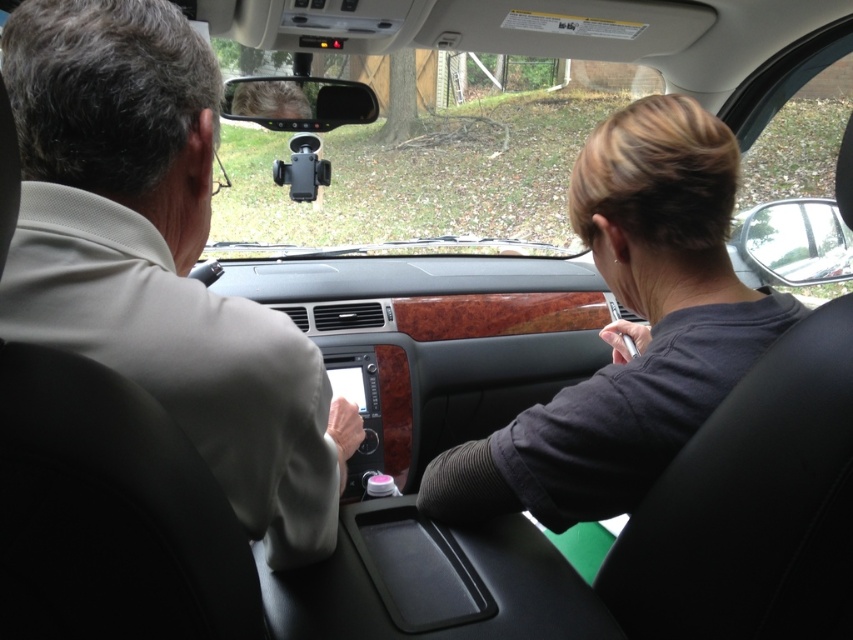
Does light beige suit at left have a greater height compared to dark gray fabric at center?

Indeed, light beige suit at left has a greater height compared to dark gray fabric at center.

Does light beige suit at left have a greater width compared to dark gray fabric at center?

Incorrect, light beige suit at left's width does not surpass dark gray fabric at center's.

Which is in front, point (184, 22) or point (444, 483)?

Positioned in front is point (184, 22).

This screenshot has height=640, width=853. Identify the location of light beige suit at left. (160, 259).

Can you confirm if dark gray fabric at center is thinner than clear glass side mirror at right?

No.

Between point (712, 320) and point (782, 216), which one is positioned behind?

The point (782, 216) is behind.

This screenshot has height=640, width=853. I want to click on dark gray fabric at center, so click(630, 330).

Does clear glass side mirror at right have a smaller size compared to clear plastic view mirror at upper center?

No, clear glass side mirror at right is not smaller than clear plastic view mirror at upper center.

Is point (813, 218) closer to camera compared to point (323, 106)?

No.

Is point (796, 269) positioned behind point (378, 108)?

No, it is in front of (378, 108).

Find the location of `clear glass side mirror at right`. clear glass side mirror at right is located at coordinates click(x=793, y=243).